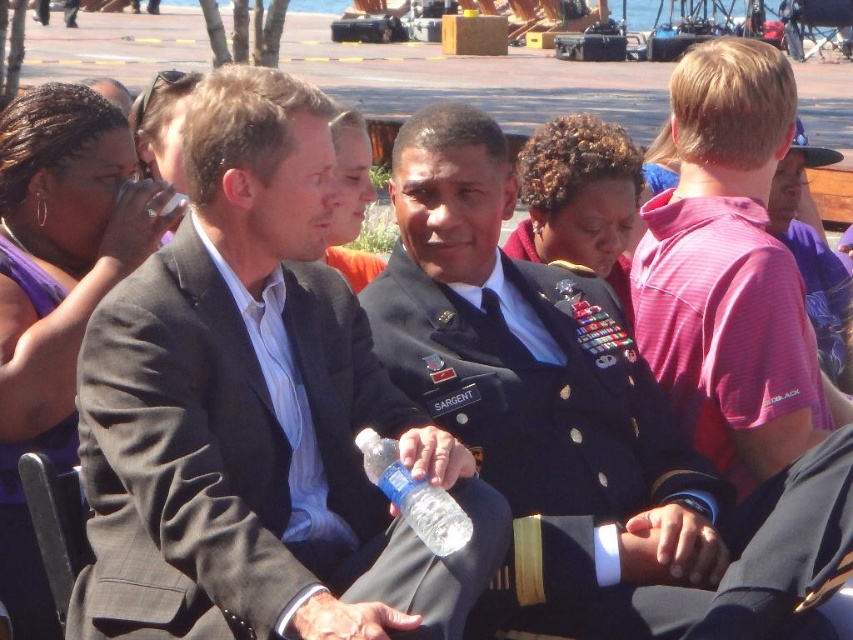
You are at a social event and want to approach the navy blue uniform at center and the matte black suit at center to introduce yourself. Which one should you approach first if you want to start with the person closest to your current position?

The navy blue uniform at center is to the right of the matte black suit at center. Since you want to start with the closest person, you should approach the matte black suit at center first as it is positioned to the left, making it closer to your current position assuming you are facing the scene.